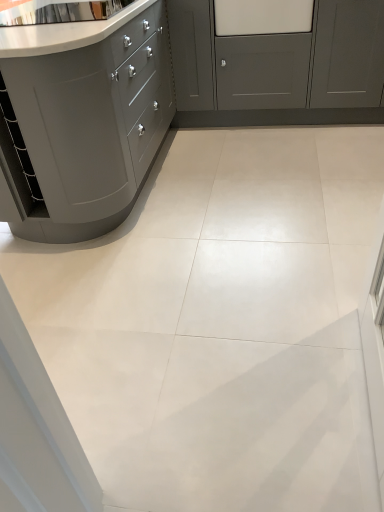
Question: Is matte gray cabinet at left, placed as the 2th cabinetry when sorted from right to left, to the left or to the right of matte gray cabinet at upper right, which appears as the second cabinetry when viewed from the left, in the image?

Choices:
 (A) left
 (B) right

Answer: (A)

Question: From a real-world perspective, is matte gray cabinet at left, the first cabinetry in the left-to-right sequence, positioned above or below matte gray cabinet at upper right, which ranks as the 1th cabinetry in right-to-left order?

Choices:
 (A) below
 (B) above

Answer: (B)

Question: From the image's perspective, is matte gray cabinet at left, placed as the 2th cabinetry when sorted from right to left, located above or below matte gray cabinet at upper right, which ranks as the 1th cabinetry in right-to-left order?

Choices:
 (A) below
 (B) above

Answer: (A)

Question: Is point (360, 79) closer or farther from the camera than point (102, 56)?

Choices:
 (A) farther
 (B) closer

Answer: (A)

Question: Is matte gray cabinet at upper right, which appears as the second cabinetry when viewed from the left, wider or thinner than matte gray cabinet at left, the first cabinetry in the left-to-right sequence?

Choices:
 (A) wide
 (B) thin

Answer: (B)

Question: From the image's perspective, is matte gray cabinet at upper right, which appears as the second cabinetry when viewed from the left, located above or below matte gray cabinet at left, the first cabinetry in the left-to-right sequence?

Choices:
 (A) above
 (B) below

Answer: (A)

Question: In the image, is matte gray cabinet at upper right, which ranks as the 1th cabinetry in right-to-left order, on the left side or the right side of matte gray cabinet at left, the first cabinetry in the left-to-right sequence?

Choices:
 (A) right
 (B) left

Answer: (A)